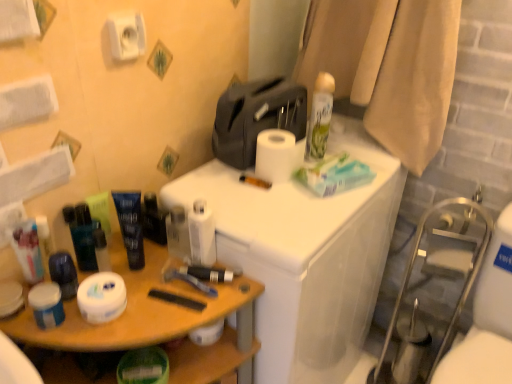
Question: Considering the relative sizes of translucent plastic can at upper right and shiny blue tube at center left, which is counted as the second toiletry, starting from the left, in the image provided, is translucent plastic can at upper right wider than shiny blue tube at center left, which is counted as the second toiletry, starting from the left,?

Choices:
 (A) yes
 (B) no

Answer: (A)

Question: Does translucent plastic can at upper right have a lesser width compared to shiny blue tube at center left, the 4th toiletry from the right?

Choices:
 (A) yes
 (B) no

Answer: (B)

Question: From the image's perspective, would you say translucent plastic can at upper right is positioned over shiny blue tube at center left, the 4th toiletry from the right?

Choices:
 (A) no
 (B) yes

Answer: (B)

Question: Considering the relative sizes of translucent plastic can at upper right and shiny blue tube at center left, which is counted as the second toiletry, starting from the left, in the image provided, is translucent plastic can at upper right smaller than shiny blue tube at center left, which is counted as the second toiletry, starting from the left,?

Choices:
 (A) yes
 (B) no

Answer: (B)

Question: Is translucent plastic can at upper right to the left of shiny blue tube at center left, the 4th toiletry from the right, from the viewer's perspective?

Choices:
 (A) no
 (B) yes

Answer: (A)

Question: Would you say translucent plastic can at upper right is outside shiny blue tube at center left, which is counted as the second toiletry, starting from the left?

Choices:
 (A) yes
 (B) no

Answer: (A)

Question: From the image's perspective, is matte black tube at center, which is counted as the fifth toiletry, starting from the left, beneath shiny blue tube at center left, which is counted as the second toiletry, starting from the left?

Choices:
 (A) yes
 (B) no

Answer: (B)

Question: Does matte black tube at center, which is counted as the fifth toiletry, starting from the left, appear on the right side of shiny blue tube at center left, the 4th toiletry from the right?

Choices:
 (A) no
 (B) yes

Answer: (B)

Question: Does matte black tube at center, which is counted as the fifth toiletry, starting from the left, have a lesser height compared to shiny blue tube at center left, which is counted as the second toiletry, starting from the left?

Choices:
 (A) no
 (B) yes

Answer: (B)

Question: Are matte black tube at center, which is counted as the fifth toiletry, starting from the left, and shiny blue tube at center left, the 4th toiletry from the right, located far from each other?

Choices:
 (A) no
 (B) yes

Answer: (A)

Question: Is matte black tube at center, which is counted as the fifth toiletry, starting from the left, thinner than shiny blue tube at center left, the 4th toiletry from the right?

Choices:
 (A) yes
 (B) no

Answer: (B)

Question: Does matte black tube at center, which is counted as the fifth toiletry, starting from the left, have a greater height compared to shiny blue tube at center left, the 4th toiletry from the right?

Choices:
 (A) yes
 (B) no

Answer: (B)

Question: Is white matte jar at left, which appears as the first toiletry when viewed from the left, further to the viewer compared to white matte toilet paper at lower left, which is counted as the fourth toilet paper, starting from the right?

Choices:
 (A) no
 (B) yes

Answer: (B)